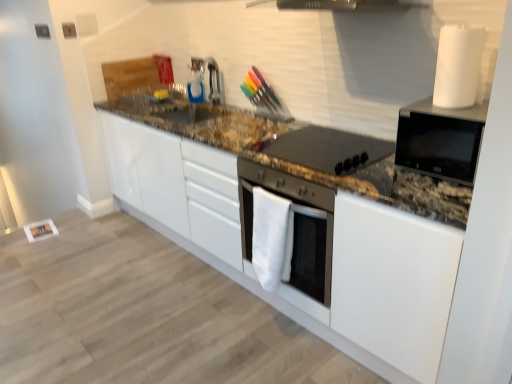
Describe the element at coordinates (326, 147) in the screenshot. I see `black matte stovetop at center` at that location.

The height and width of the screenshot is (384, 512). What do you see at coordinates (440, 139) in the screenshot? I see `black glossy microwave at upper right, which appears as the 2th home appliance when ordered from the bottom` at bounding box center [440, 139].

The height and width of the screenshot is (384, 512). What do you see at coordinates (213, 82) in the screenshot?
I see `satin nickel faucet at upper center` at bounding box center [213, 82].

What do you see at coordinates (304, 216) in the screenshot?
I see `granite at center` at bounding box center [304, 216].

The image size is (512, 384). Identify the location of white fabric oven at center, the second home appliance positioned from the top. (301, 226).

Find the location of a particular element. black matte stovetop at center is located at coordinates (326, 147).

In the image, is satin nickel faucet at upper center on the left side or the right side of white fabric oven at center, the first home appliance when ordered from left to right?

satin nickel faucet at upper center is positioned on white fabric oven at center, the first home appliance when ordered from left to right,'s left side.

Is satin nickel faucet at upper center next to white fabric oven at center, the first home appliance when ordered from left to right, and touching it?

No, satin nickel faucet at upper center is not touching white fabric oven at center, the first home appliance when ordered from left to right.

Is satin nickel faucet at upper center oriented towards white fabric oven at center, the first home appliance when ordered from left to right?

No.

Who is more distant, satin nickel faucet at upper center or white fabric oven at center, placed as the 1th home appliance when sorted from bottom to top?

satin nickel faucet at upper center is further away from the camera.

Which of these two, black glossy microwave at upper right, placed as the first home appliance when sorted from right to left, or white fabric oven at center, placed as the 1th home appliance when sorted from bottom to top, is smaller?

With smaller size is white fabric oven at center, placed as the 1th home appliance when sorted from bottom to top.

Is black glossy microwave at upper right, which appears as the 2th home appliance when ordered from the bottom, located outside white fabric oven at center, placed as the 1th home appliance when sorted from bottom to top?

black glossy microwave at upper right, which appears as the 2th home appliance when ordered from the bottom, is positioned outside white fabric oven at center, placed as the 1th home appliance when sorted from bottom to top.

Considering the sizes of black glossy microwave at upper right, placed as the first home appliance when sorted from right to left, and white fabric oven at center, the first home appliance when ordered from left to right, in the image, is black glossy microwave at upper right, placed as the first home appliance when sorted from right to left, taller or shorter than white fabric oven at center, the first home appliance when ordered from left to right,?

In the image, black glossy microwave at upper right, placed as the first home appliance when sorted from right to left, appears to be shorter than white fabric oven at center, the first home appliance when ordered from left to right.

Does point (411, 120) lie in front of point (150, 150)?

Yes.

Would you say black glossy microwave at upper right, placed as the first home appliance when sorted from right to left, is to the left or to the right of granite at center in the picture?

black glossy microwave at upper right, placed as the first home appliance when sorted from right to left, is positioned on granite at center's right side.

From the image's perspective, is black glossy microwave at upper right, which appears as the 2th home appliance when ordered from the bottom, below granite at center?

No, from the image's perspective, black glossy microwave at upper right, which appears as the 2th home appliance when ordered from the bottom, is not beneath granite at center.

From a real-world perspective, is black glossy microwave at upper right, acting as the second home appliance starting from the left, above or below granite at center?

black glossy microwave at upper right, acting as the second home appliance starting from the left, is above granite at center.

Considering the relative positions of white fabric oven at center, which is the second home appliance from right to left, and granite at center in the image provided, is white fabric oven at center, which is the second home appliance from right to left, to the left or to the right of granite at center?

white fabric oven at center, which is the second home appliance from right to left, is to the right of granite at center.

Which of these two, white fabric oven at center, which is the second home appliance from right to left, or granite at center, stands shorter?

With less height is white fabric oven at center, which is the second home appliance from right to left.

Considering the sizes of objects white fabric oven at center, which is the second home appliance from right to left, and granite at center in the image provided, who is bigger, white fabric oven at center, which is the second home appliance from right to left, or granite at center?

granite at center.

Does white fabric oven at center, the second home appliance positioned from the top, have a lesser width compared to granite at center?

Indeed, white fabric oven at center, the second home appliance positioned from the top, has a lesser width compared to granite at center.

Looking at this image, which is in front, granite at center or white fabric oven at center, the first home appliance when ordered from left to right?

granite at center is closer to the camera.

Is granite at center facing towards white fabric oven at center, placed as the 1th home appliance when sorted from bottom to top?

Yes.

From the picture: Who is taller, granite at center or white fabric oven at center, placed as the 1th home appliance when sorted from bottom to top?

With more height is granite at center.

In the scene shown: Is satin nickel faucet at upper center next to granite at center and touching it?

satin nickel faucet at upper center is not next to granite at center, and they're not touching.

Who is taller, satin nickel faucet at upper center or granite at center?

granite at center.

From a real-world perspective, between satin nickel faucet at upper center and granite at center, who is vertically lower?

granite at center.

You are a GUI agent. You are given a task and a screenshot of the screen. Output one action in this format:
    pyautogui.click(x=<x>, y=<y>)
    Task: Click on the countertop on the right of satin nickel faucet at upper center
    The width and height of the screenshot is (512, 384).
    Given the screenshot: What is the action you would take?
    pyautogui.click(x=304, y=216)

Would you say satin nickel faucet at upper center is inside or outside black glossy microwave at upper right, which appears as the 2th home appliance when ordered from the bottom?

satin nickel faucet at upper center is not enclosed by black glossy microwave at upper right, which appears as the 2th home appliance when ordered from the bottom.

Would you say satin nickel faucet at upper center is a long distance from black glossy microwave at upper right, acting as the second home appliance starting from the left?

That's right, there is a large distance between satin nickel faucet at upper center and black glossy microwave at upper right, acting as the second home appliance starting from the left.

Which is closer, (210, 82) or (474, 169)?

The point (474, 169) is closer to the camera.

Is satin nickel faucet at upper center facing towards black glossy microwave at upper right, which appears as the 2th home appliance when ordered from the bottom?

No, satin nickel faucet at upper center is not turned towards black glossy microwave at upper right, which appears as the 2th home appliance when ordered from the bottom.

From the image's perspective, which home appliance is the 2nd one below the satin nickel faucet at upper center? Please provide its 2D coordinates.

[(301, 226)]

Where is `home appliance below the black glossy microwave at upper right, the 1th home appliance in the top-to-bottom sequence (from a real-world perspective)`? This screenshot has height=384, width=512. home appliance below the black glossy microwave at upper right, the 1th home appliance in the top-to-bottom sequence (from a real-world perspective) is located at coordinates (301, 226).

Considering their positions, is black matte stovetop at center positioned further to black glossy microwave at upper right, acting as the second home appliance starting from the left, than satin nickel faucet at upper center?

satin nickel faucet at upper center is positioned further to the anchor black glossy microwave at upper right, acting as the second home appliance starting from the left.

Which object lies nearer to the anchor point black matte stovetop at center, granite at center or black glossy microwave at upper right, acting as the second home appliance starting from the left?

Based on the image, granite at center appears to be nearer to black matte stovetop at center.

Which object lies further to the anchor point white fabric oven at center, the first home appliance when ordered from left to right, granite at center or black glossy microwave at upper right, which appears as the 2th home appliance when ordered from the bottom?

black glossy microwave at upper right, which appears as the 2th home appliance when ordered from the bottom, is further to white fabric oven at center, the first home appliance when ordered from left to right.

Estimate the real-world distances between objects in this image. Which object is further from black glossy microwave at upper right, acting as the second home appliance starting from the left, white fabric oven at center, the second home appliance positioned from the top, or black matte stovetop at center?

white fabric oven at center, the second home appliance positioned from the top, is further to black glossy microwave at upper right, acting as the second home appliance starting from the left.

When comparing their distances from black matte stovetop at center, does black glossy microwave at upper right, the 1th home appliance in the top-to-bottom sequence, or satin nickel faucet at upper center seem closer?

Among the two, black glossy microwave at upper right, the 1th home appliance in the top-to-bottom sequence, is located nearer to black matte stovetop at center.

In the scene shown: Estimate the real-world distances between objects in this image. Which object is closer to satin nickel faucet at upper center, granite at center or black glossy microwave at upper right, placed as the first home appliance when sorted from right to left?

granite at center is closer to satin nickel faucet at upper center.

When comparing their distances from granite at center, does white fabric oven at center, which is the second home appliance from right to left, or black glossy microwave at upper right, acting as the second home appliance starting from the left, seem further?

Based on the image, black glossy microwave at upper right, acting as the second home appliance starting from the left, appears to be further to granite at center.

Looking at the image, which one is located closer to granite at center, white fabric oven at center, the second home appliance positioned from the top, or black matte stovetop at center?

white fabric oven at center, the second home appliance positioned from the top, is closer to granite at center.

Identify the location of kitchen appliance between granite at center and white fabric oven at center, placed as the 1th home appliance when sorted from bottom to top, in the front-back direction. This screenshot has width=512, height=384. (326, 147).

At what (x,y) coordinates should I click in order to perform the action: click on home appliance between black matte stovetop at center and satin nickel faucet at upper center in the front-back direction. Please return your answer as a coordinate pair (x, y). Looking at the image, I should click on (301, 226).

You are a GUI agent. You are given a task and a screenshot of the screen. Output one action in this format:
    pyautogui.click(x=<x>, y=<y>)
    Task: Click on the kitchen appliance between white fabric oven at center, which is the second home appliance from right to left, and black glossy microwave at upper right, the 1th home appliance in the top-to-bottom sequence, from left to right
    The height and width of the screenshot is (384, 512).
    Given the screenshot: What is the action you would take?
    pyautogui.click(x=326, y=147)

This screenshot has width=512, height=384. In order to click on home appliance between granite at center and black glossy microwave at upper right, which appears as the 2th home appliance when ordered from the bottom in this screenshot , I will do click(x=301, y=226).